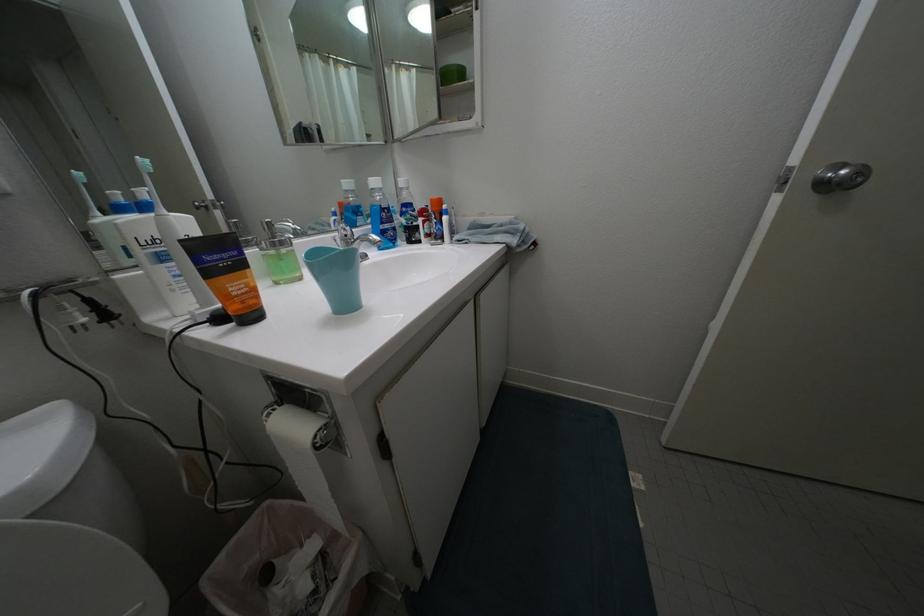
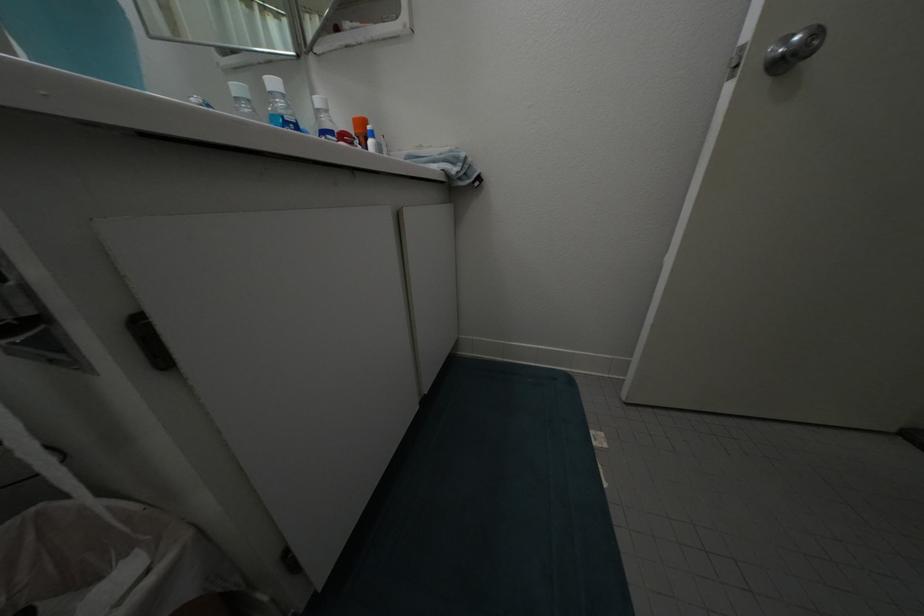
Question: Based on the continuous images, in which direction is the camera rotating? Reply with the corresponding letter.

Choices:
 (A) Left
 (B) Right
 (C) Up
 (D) Down

Answer: (B)